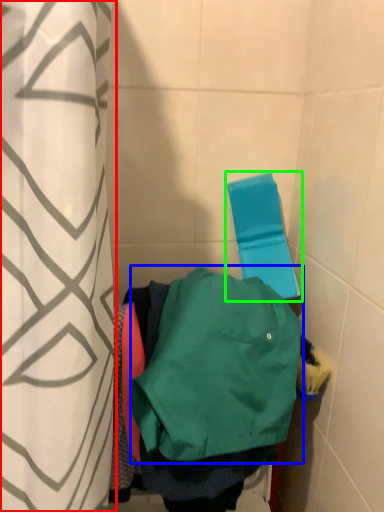
Question: Estimate the real-world distances between objects in this image. Which object is closer to curtain (highlighted by a red box), sweatshirt (highlighted by a blue box) or beach towel (highlighted by a green box)?

Choices:
 (A) sweatshirt
 (B) beach towel

Answer: (A)